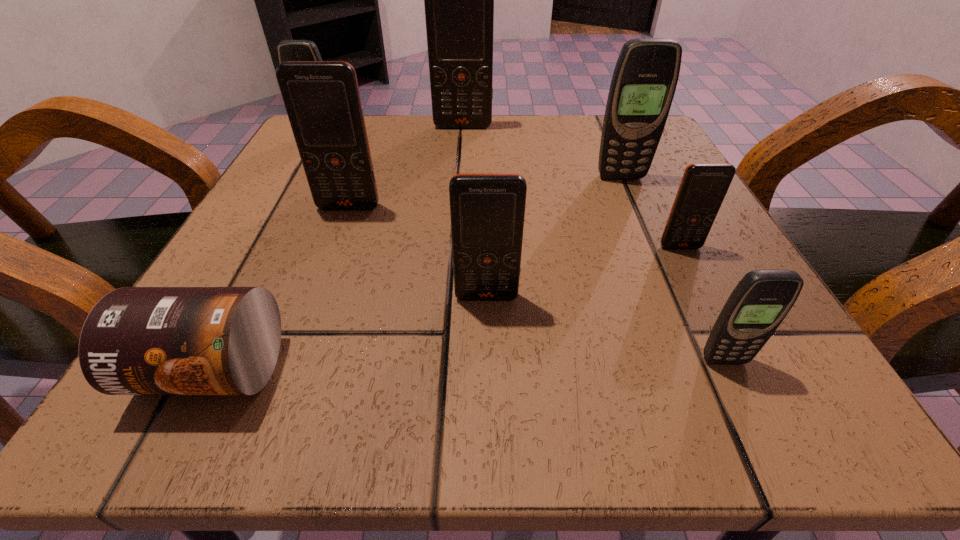
You are a GUI agent. You are given a task and a screenshot of the screen. Output one action in this format:
    pyautogui.click(x=<x>, y=<y>)
    Task: Click on the biggest orange cellular telephone
    The image size is (960, 540).
    Given the screenshot: What is the action you would take?
    pyautogui.click(x=459, y=0)

This screenshot has width=960, height=540. I want to click on the farthest object, so click(459, 0).

This screenshot has width=960, height=540. Find the location of `the fifth nearest object`. the fifth nearest object is located at coordinates (322, 99).

This screenshot has width=960, height=540. Identify the location of the sixth cellular telephone from right to left. (322, 99).

This screenshot has width=960, height=540. In order to click on the biggest gray cellular telephone in this screenshot , I will do `click(645, 77)`.

The height and width of the screenshot is (540, 960). I want to click on the third farthest cellular telephone, so click(645, 77).

Locate an element on the screen. The height and width of the screenshot is (540, 960). the farthest gray cellular telephone is located at coordinates (288, 50).

Where is `the leftmost gray cellular telephone`? This screenshot has height=540, width=960. the leftmost gray cellular telephone is located at coordinates (288, 50).

In order to click on the second smallest orange cellular telephone in this screenshot , I will do `click(487, 211)`.

At what (x,y) coordinates should I click in order to perform the action: click on the third nearest object. Please return your answer as a coordinate pair (x, y). This screenshot has width=960, height=540. Looking at the image, I should click on (487, 211).